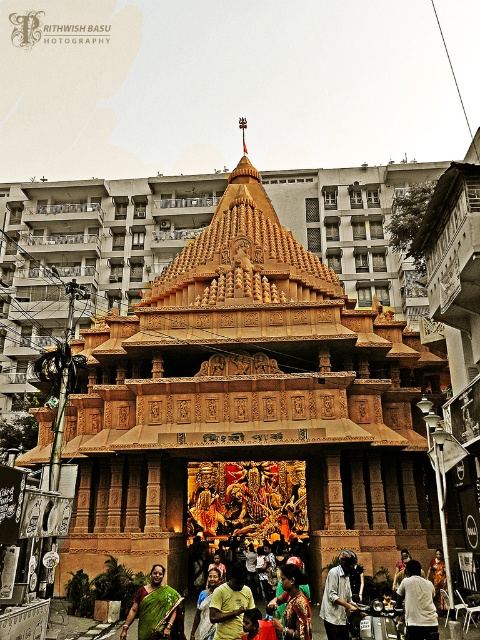
Question: From the image, what is the correct spatial relationship of dark gray fabric jacket at lower center in relation to white cotton shirt at lower right?

Choices:
 (A) left
 (B) right

Answer: (A)

Question: Which object is the closest to the green fabric dress at center?

Choices:
 (A) green silk saree at center
 (B) dark gray fabric jacket at lower center
 (C) matte gold statue at center
 (D) yellow cotton shirt at center

Answer: (B)

Question: Which object appears farthest from the camera in this image?

Choices:
 (A) matte gold statue at center
 (B) white cotton shirt at lower right
 (C) dark gray fabric jacket at lower center

Answer: (A)

Question: Which of the following is the farthest from the observer?

Choices:
 (A) (302, 620)
 (B) (435, 552)
 (C) (431, 625)
 (D) (218, 576)

Answer: (B)

Question: Does green silk saree at center have a larger size compared to green silk saree at lower center?

Choices:
 (A) no
 (B) yes

Answer: (B)

Question: Is green silk saree at center positioned at the back of white fabric dress at lower center?

Choices:
 (A) no
 (B) yes

Answer: (A)